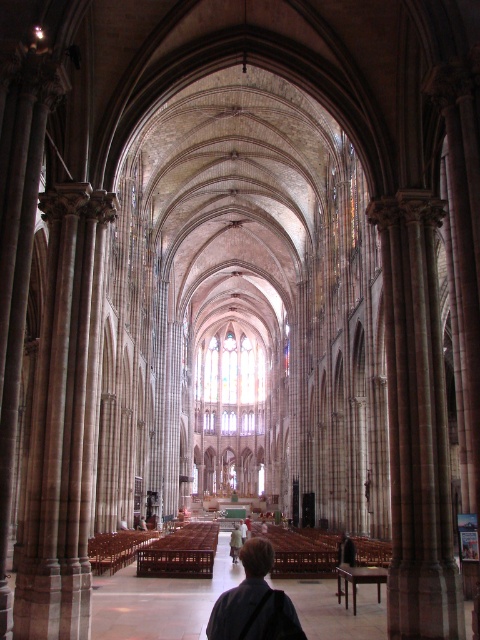
Is brown stone pillar at left above brown hair at center?

Yes, brown stone pillar at left is above brown hair at center.

Does point (74, 476) come behind point (233, 531)?

No, it is not.

Locate an element on the screen. brown stone pillar at left is located at coordinates (62, 420).

Image resolution: width=480 pixels, height=640 pixels. In order to click on brown stone pillar at left in this screenshot , I will do `click(62, 420)`.

Which is more to the right, brown stone pillar at left or stained glass window at center?

Positioned to the right is stained glass window at center.

Which is in front, point (69, 522) or point (229, 330)?

Positioned in front is point (69, 522).

Locate an element on the screen. brown stone pillar at left is located at coordinates (62, 420).

Where is `brown stone pillar at left`? brown stone pillar at left is located at coordinates (62, 420).

Which of these two, brown stone pillar at right or brown hair at center, stands shorter?

brown hair at center is shorter.

Which is more to the right, brown stone pillar at right or brown hair at center?

Positioned to the right is brown stone pillar at right.

Does point (400, 458) come closer to viewer compared to point (232, 550)?

Yes, point (400, 458) is in front of point (232, 550).

At what (x,y) coordinates should I click in order to perform the action: click on brown stone pillar at right. Please return your answer as a coordinate pair (x, y). Image resolution: width=480 pixels, height=640 pixels. Looking at the image, I should click on (417, 422).